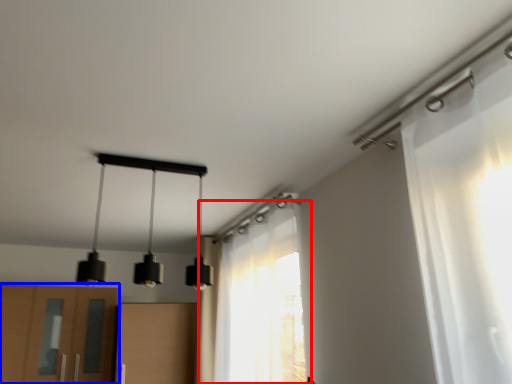
Question: Which of the following is the farthest to the observer, curtain (highlighted by a red box) or cabinetry (highlighted by a blue box)?

Choices:
 (A) curtain
 (B) cabinetry

Answer: (B)